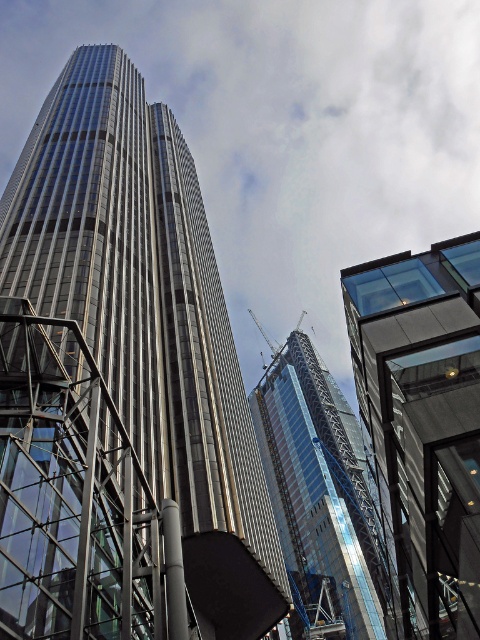
Is point (388, 499) positioned after point (264, 468)?

No, (388, 499) is in front of (264, 468).

Is glassy reflective building at right closer to camera compared to glassy steel skyscraper at center?

That is True.

Does point (466, 340) come farther from viewer compared to point (351, 579)?

No, it is not.

You are a GUI agent. You are given a task and a screenshot of the screen. Output one action in this format:
    pyautogui.click(x=<x>, y=<y>)
    Task: Click on the glassy reflective building at right
    
    Given the screenshot: What is the action you would take?
    click(422, 426)

Is glassy metallic skyscraper at center closer to the viewer compared to glassy reflective building at right?

No, glassy metallic skyscraper at center is behind glassy reflective building at right.

Who is shorter, glassy metallic skyscraper at center or glassy reflective building at right?

With less height is glassy reflective building at right.

In order to click on glassy metallic skyscraper at center in this screenshot , I will do `click(148, 320)`.

Is glassy metallic skyscraper at center below glassy steel skyscraper at center?

No, glassy metallic skyscraper at center is not below glassy steel skyscraper at center.

Is glassy metallic skyscraper at center to the right of glassy steel skyscraper at center from the viewer's perspective?

No, glassy metallic skyscraper at center is not to the right of glassy steel skyscraper at center.

Measure the distance between point (146,355) and camera.

Point (146,355) and camera are 61.67 meters apart.

Where is `glassy metallic skyscraper at center`? The image size is (480, 640). glassy metallic skyscraper at center is located at coordinates (148, 320).